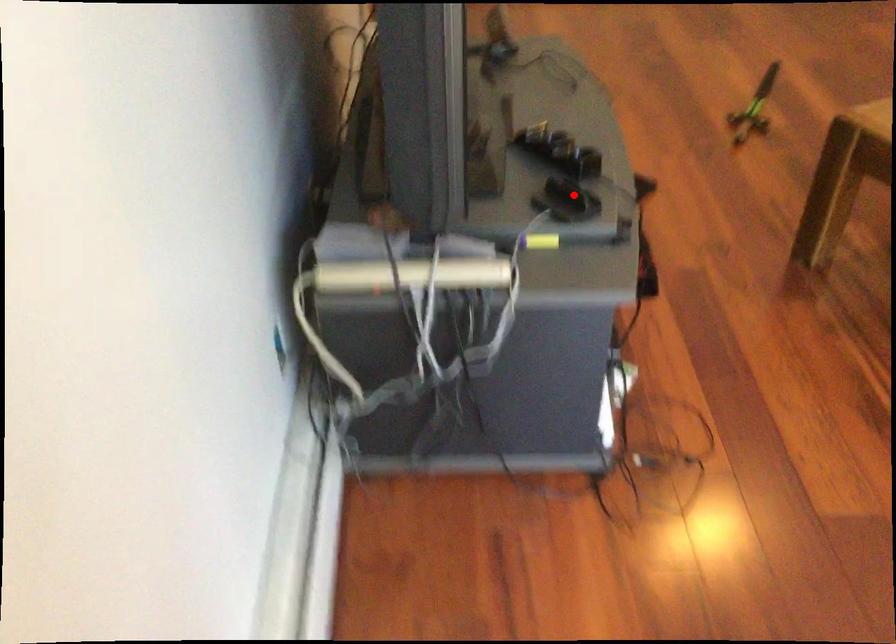
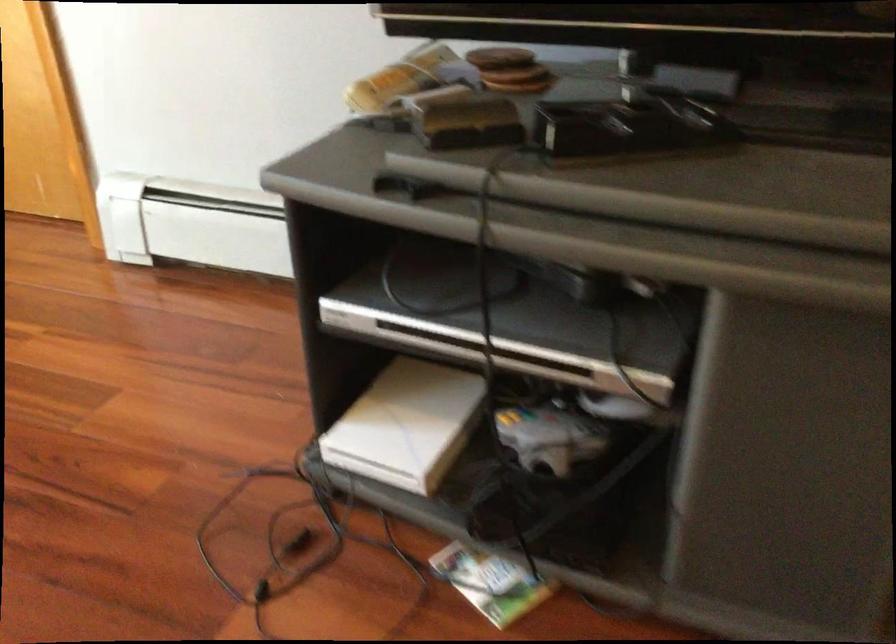
Question: A red point is marked in image1. In image2, is the corresponding 3D point closer to the camera or farther? Reply with the corresponding letter.

Choices:
 (A) The corresponding 3D point is closer.
 (B) The corresponding 3D point is farther.

Answer: (A)